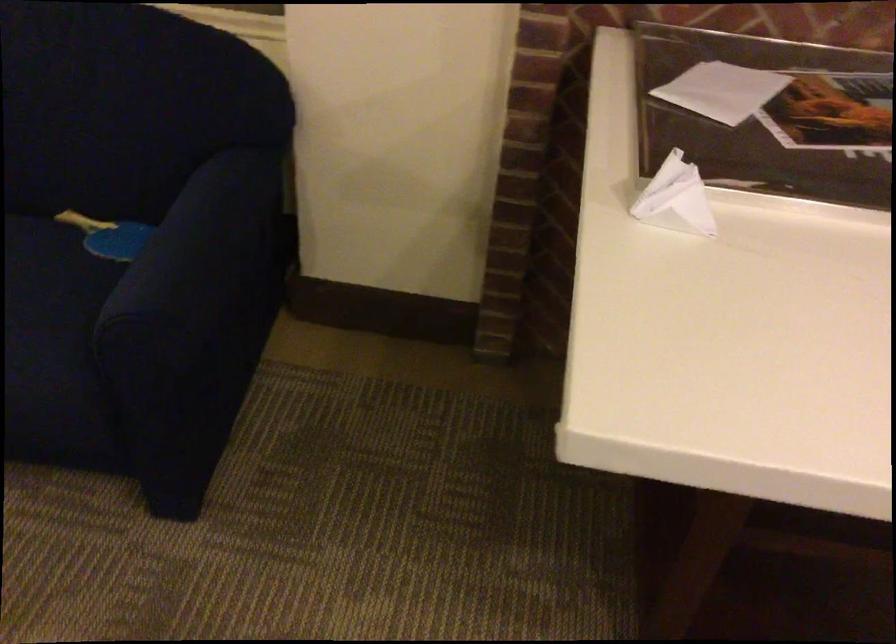
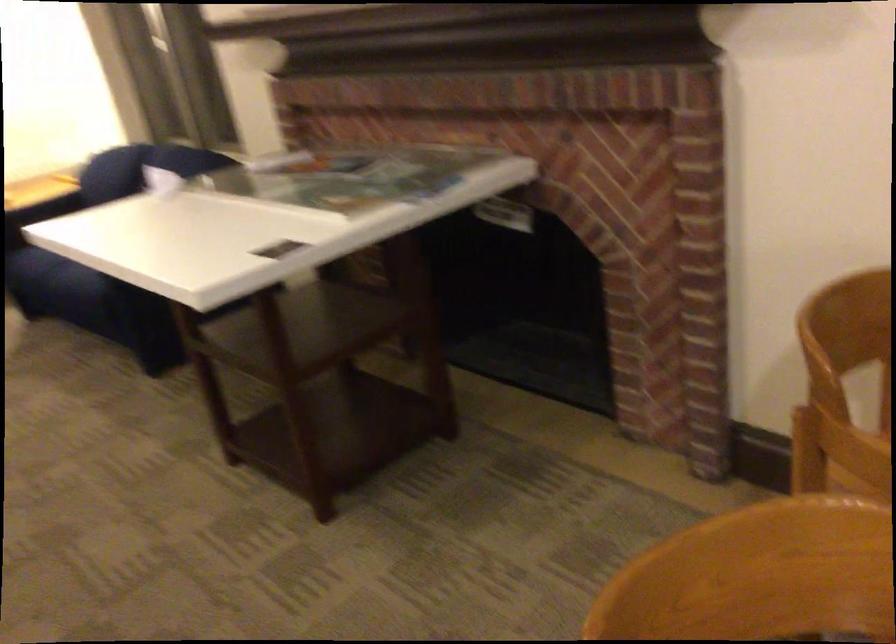
Question: I am providing you with two images of the same scene from different viewpoints. After the viewpoint changes to image2, which objects are now occluded?

Choices:
 (A) dark picture frame
 (B) soda bottle
 (C) sofa armrest
 (D) sofa sitting surface

Answer: (A)